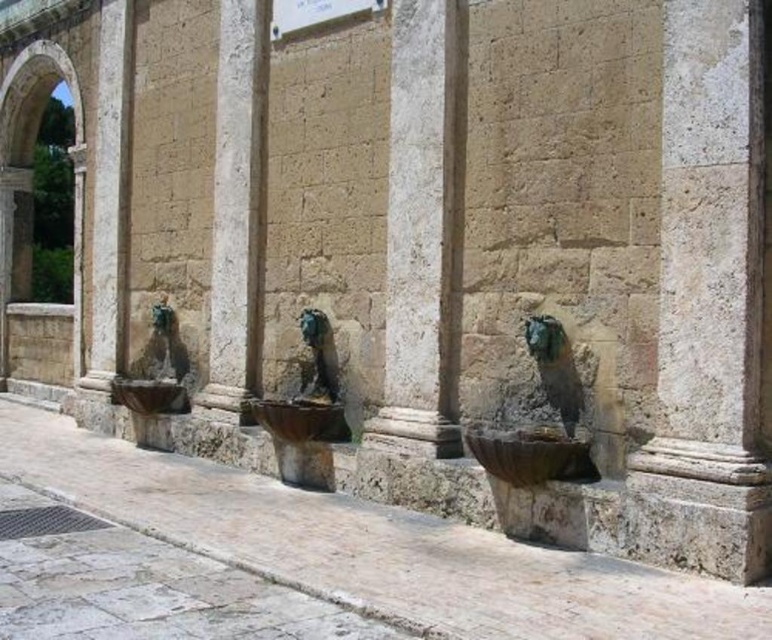
Question: Is stone archway at upper left bigger than smooth stone arch at left?

Choices:
 (A) no
 (B) yes

Answer: (A)

Question: Is smooth stone pillar at center smaller than green stone fountain at center?

Choices:
 (A) no
 (B) yes

Answer: (A)

Question: Which object is positioned closest to the smooth stone pillar at center?

Choices:
 (A) green stone fountain at center
 (B) green patina stone lion at center
 (C) white stone column at center
 (D) stone archway at upper left

Answer: (B)

Question: Can you confirm if smooth stone arch at left is bigger than green stone fountain at center?

Choices:
 (A) no
 (B) yes

Answer: (B)

Question: Estimate the real-world distances between objects in this image. Which object is closer to the smooth stone pillar at center?

Choices:
 (A) white stone column at center
 (B) smooth stone arch at left
 (C) green patina stone lion at center

Answer: (C)

Question: Which of these objects is positioned closest to the green patina stone lion at center?

Choices:
 (A) stone archway at upper left
 (B) smooth stone pillar at center

Answer: (B)